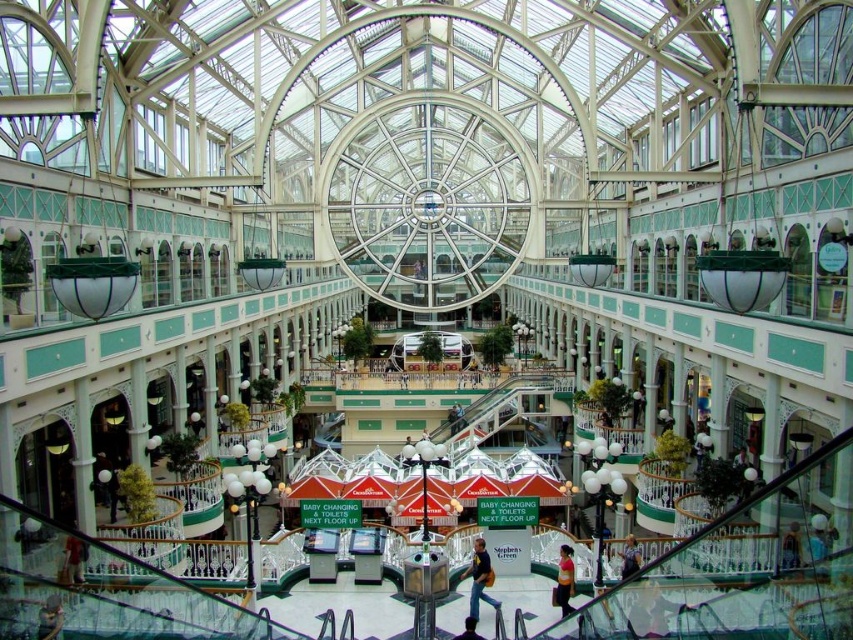
You are a customer in the mall and want to buy the matte pink shirt at center. You are standing 69.86 meters away from it. Is the shirt within your reach?

The matte pink shirt at center is 69.86 meters away from you, so it is too far to reach. Please approach closer.

You are a customer looking for the exit sign in a mall. You see jeans at center and blue denim jeans at lower center. Which jeans are closer to you?

The jeans at center is closer to you because it is in front of the blue denim jeans at lower center.